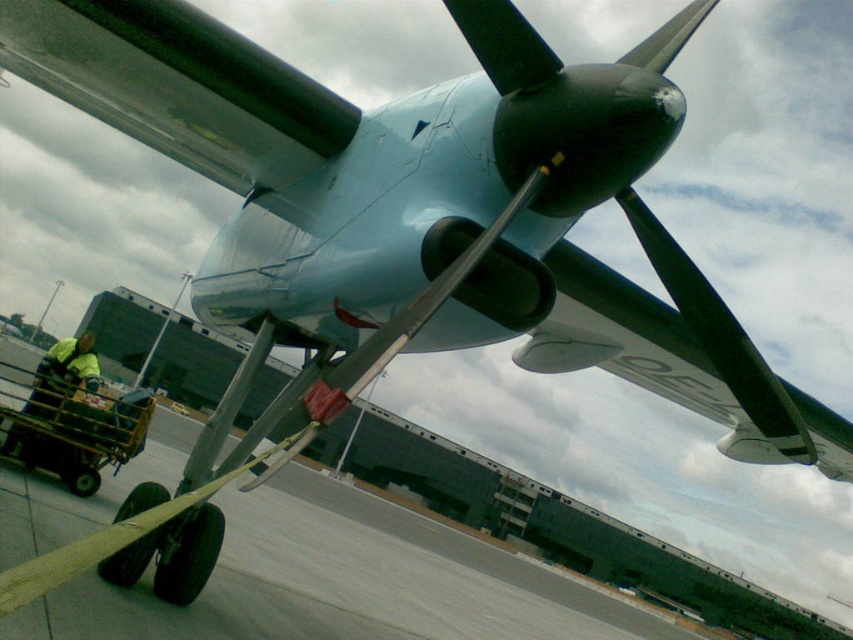
Is metallic yellow cart at lower left closer to the viewer compared to yellow reflective vest at lower left?

That is True.

Which is in front, point (1, 362) or point (22, 435)?

Positioned in front is point (1, 362).

The width and height of the screenshot is (853, 640). What are the coordinates of `metallic yellow cart at lower left` in the screenshot? It's located at (74, 428).